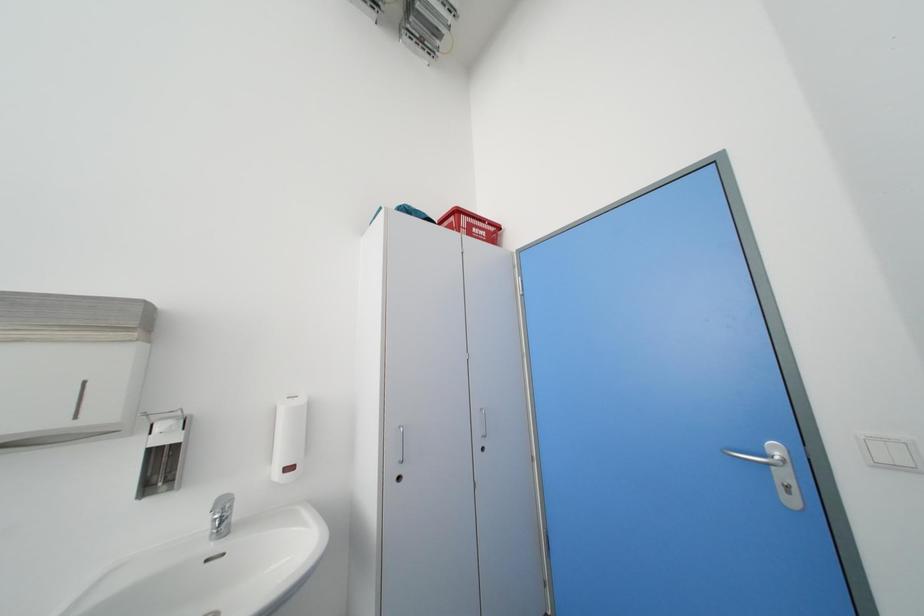
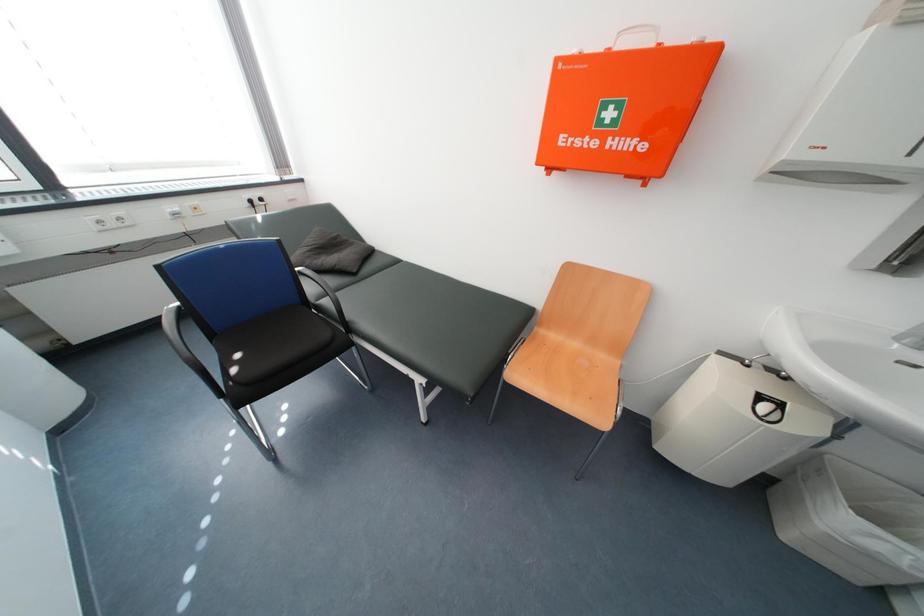
Based on the continuous images, in which direction is the camera rotating?

The camera rotated toward left-down.